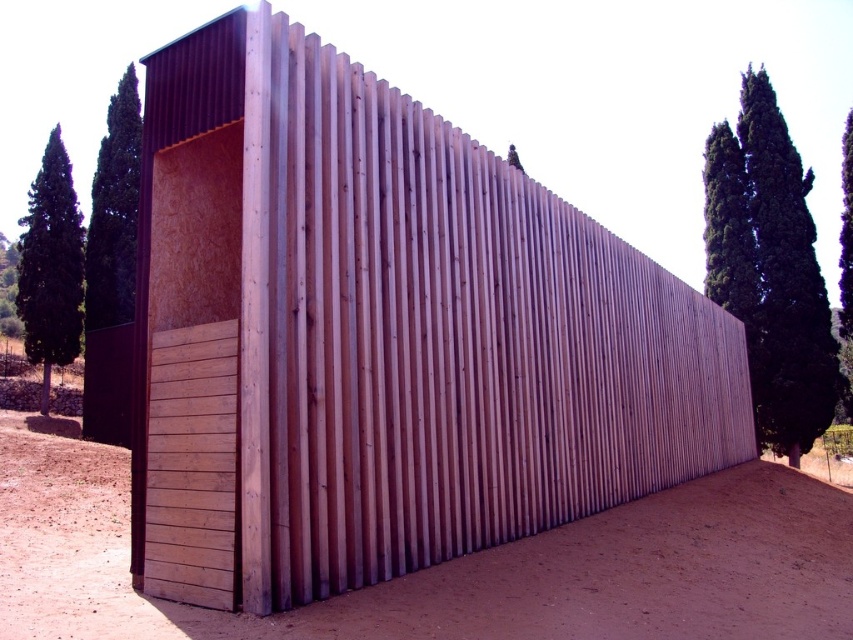
Question: Is brown sandy dirt at lower center in front of green leafy cypress at left?

Choices:
 (A) yes
 (B) no

Answer: (A)

Question: Which object appears closest to the camera in this image?

Choices:
 (A) green textured cypress tree at left
 (B) wooden fence at center
 (C) green leafy cypress at upper right

Answer: (B)

Question: Observing the image, what is the correct spatial positioning of brown sandy dirt at lower center in reference to green leafy cypress at upper right?

Choices:
 (A) right
 (B) left

Answer: (B)

Question: Which point is farther to the camera?

Choices:
 (A) 57,147
 (B) 462,484
 (C) 114,186

Answer: (A)

Question: Which is nearer to the green leafy cypress at left?

Choices:
 (A) green textured cypress tree at left
 (B) brown sandy dirt at lower center
 (C) wooden fence at center
 (D) green leafy cypress at upper right

Answer: (A)

Question: Does brown sandy dirt at lower center appear over green leafy cypress at upper right?

Choices:
 (A) yes
 (B) no

Answer: (B)